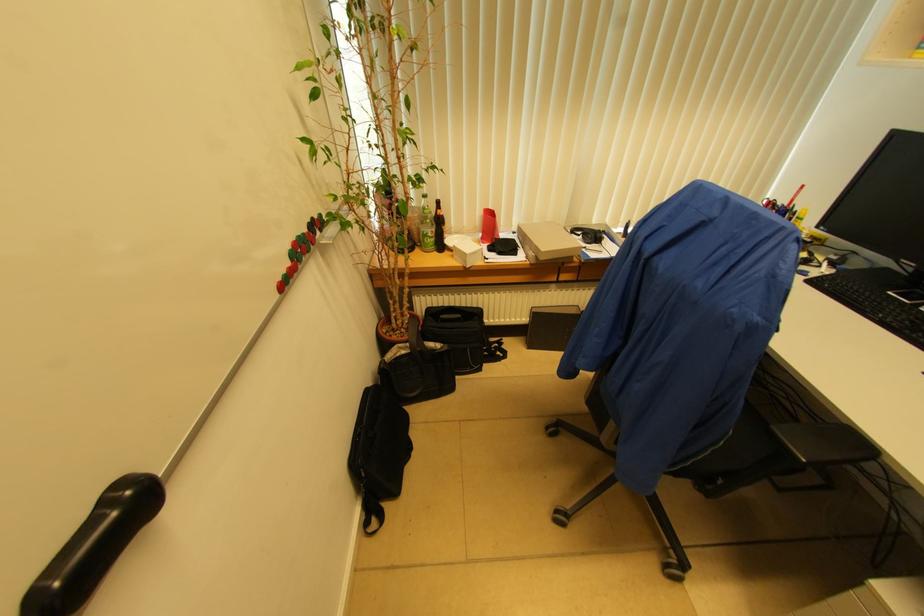
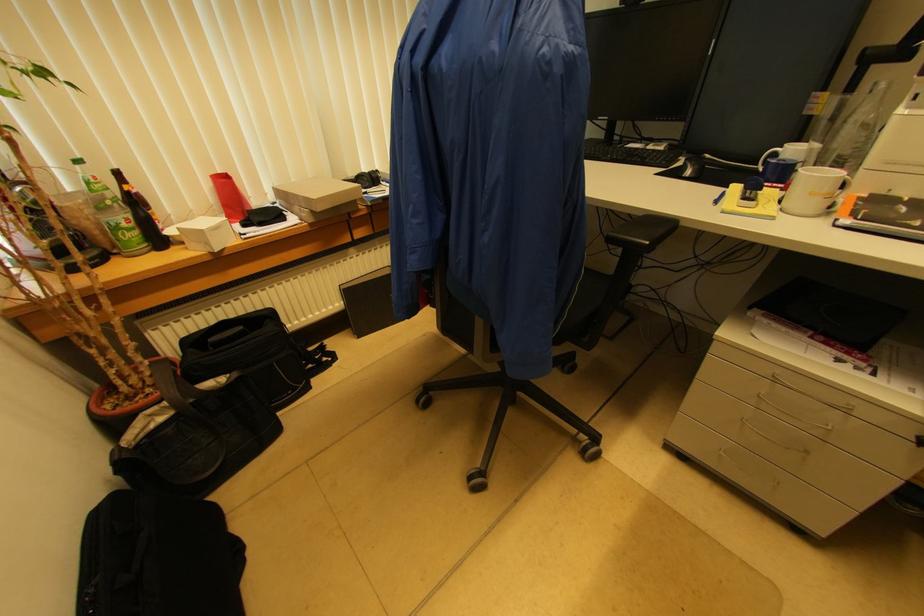
Question: How did the camera likely rotate?

Choices:
 (A) Left
 (B) Right
 (C) Up
 (D) Down

Answer: (B)